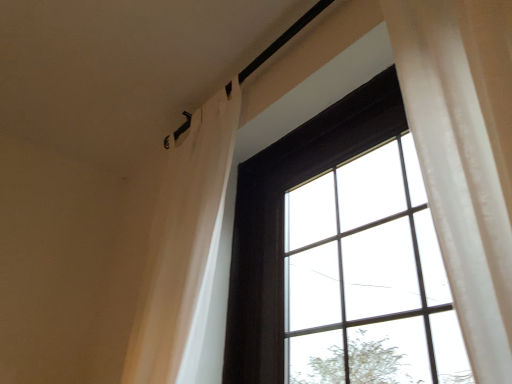
Question: Is matte black window at center wider than white sheer curtain at upper left?

Choices:
 (A) yes
 (B) no

Answer: (B)

Question: Considering the relative positions of matte black window at center and white sheer curtain at upper left in the image provided, is matte black window at center to the right of white sheer curtain at upper left from the viewer's perspective?

Choices:
 (A) yes
 (B) no

Answer: (A)

Question: Can you confirm if matte black window at center is smaller than white sheer curtain at upper left?

Choices:
 (A) no
 (B) yes

Answer: (A)

Question: Is matte black window at center further to the viewer compared to white sheer curtain at upper left?

Choices:
 (A) no
 (B) yes

Answer: (A)

Question: From a real-world perspective, is matte black window at center on white sheer curtain at upper left?

Choices:
 (A) yes
 (B) no

Answer: (B)

Question: Is matte black window at center beside white sheer curtain at upper left?

Choices:
 (A) yes
 (B) no

Answer: (B)

Question: Is white sheer curtain at upper left further to the viewer compared to matte black window at center?

Choices:
 (A) yes
 (B) no

Answer: (A)

Question: From a real-world perspective, is white sheer curtain at upper left located beneath matte black window at center?

Choices:
 (A) no
 (B) yes

Answer: (A)

Question: Does white sheer curtain at upper left appear on the left side of matte black window at center?

Choices:
 (A) yes
 (B) no

Answer: (A)

Question: Can you confirm if white sheer curtain at upper left is smaller than matte black window at center?

Choices:
 (A) yes
 (B) no

Answer: (A)

Question: From a real-world perspective, does white sheer curtain at upper left stand above matte black window at center?

Choices:
 (A) no
 (B) yes

Answer: (B)

Question: Is white sheer curtain at upper left shorter than matte black window at center?

Choices:
 (A) yes
 (B) no

Answer: (B)

Question: Looking at the image, does matte black window at center seem bigger or smaller compared to white sheer curtain at upper left?

Choices:
 (A) big
 (B) small

Answer: (A)